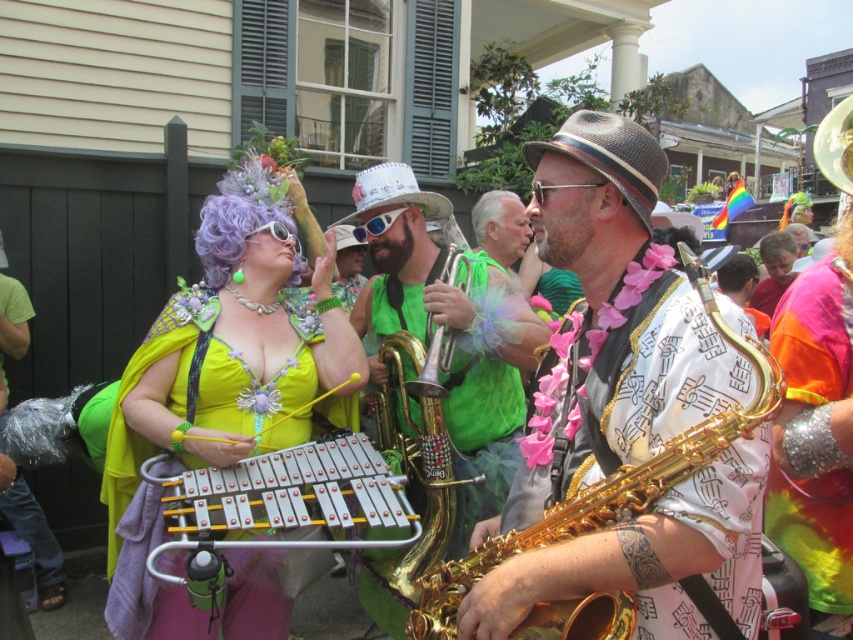
Is gold shiny saxophone at center closer to camera compared to gray synthetic wig at center?

Yes, gold shiny saxophone at center is in front of gray synthetic wig at center.

Does point (686, 513) come closer to viewer compared to point (482, 202)?

Yes, it is in front of point (482, 202).

In order to click on gold shiny saxophone at center in this screenshot , I will do `click(613, 317)`.

Does gold shiny saxophone at center have a lesser width compared to matte yellow dress at center?

Yes.

This screenshot has width=853, height=640. What do you see at coordinates (613, 317) in the screenshot?
I see `gold shiny saxophone at center` at bounding box center [613, 317].

This screenshot has width=853, height=640. In order to click on gold shiny saxophone at center in this screenshot , I will do `click(613, 317)`.

Who is more forward, (397, 225) or (42, 518)?

Positioned in front is point (397, 225).

Identify the location of shiny gold saxophone at center. (450, 326).